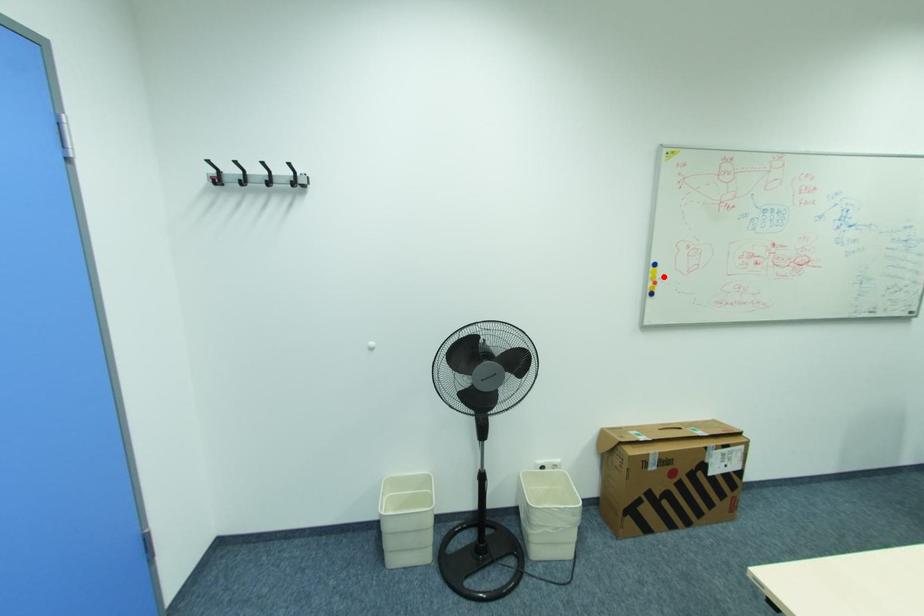
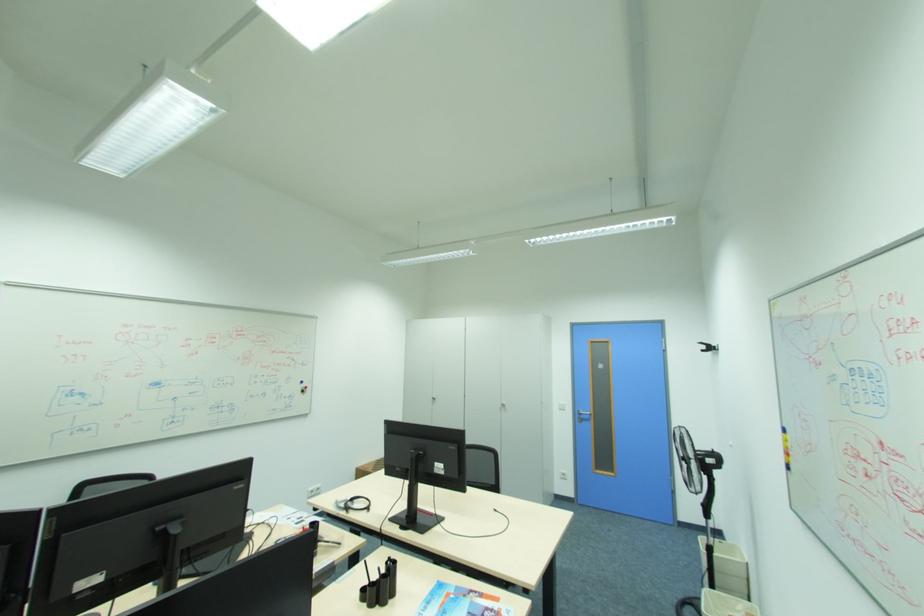
Where in the second image is the point corresponding to the highlighted location from the first image?

(794, 446)